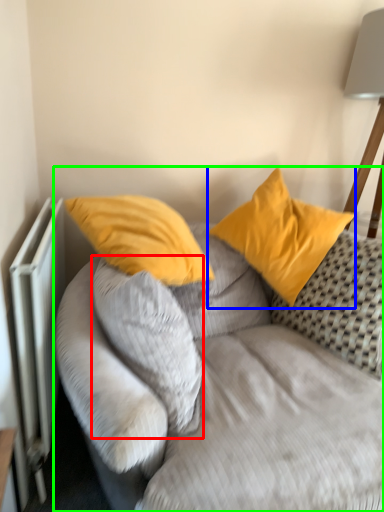
Question: Which object is the closest to the pillow (highlighted by a red box)? Choose among these: pillow (highlighted by a blue box) or studio couch (highlighted by a green box).

Choices:
 (A) pillow
 (B) studio couch

Answer: (B)